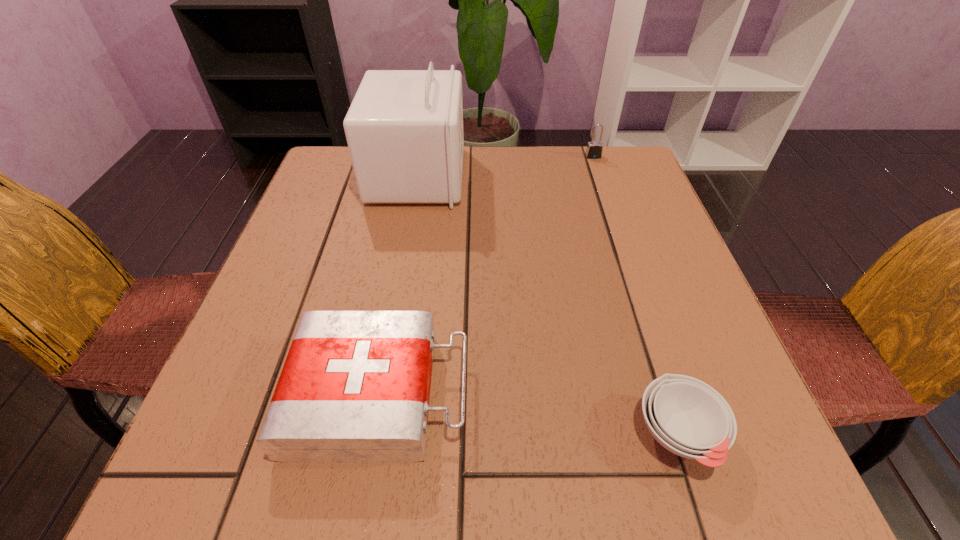
At what (x,y) coordinates should I click in order to perform the action: click on vacant space that satisfies the following two spatial constraints: 1. on the front side of the shorter first-aid kit; 2. on the left side of the soup bowl. Please return your answer as a coordinate pair (x, y). The height and width of the screenshot is (540, 960). Looking at the image, I should click on (372, 434).

You are a GUI agent. You are given a task and a screenshot of the screen. Output one action in this format:
    pyautogui.click(x=<x>, y=<y>)
    Task: Click on the blank space that satisfies the following two spatial constraints: 1. on the shackle of the padlock; 2. on the front-facing side of the tallest object
    
    Given the screenshot: What is the action you would take?
    pyautogui.click(x=599, y=176)

The height and width of the screenshot is (540, 960). I want to click on free location that satisfies the following two spatial constraints: 1. on the shackle of the padlock; 2. on the front-facing side of the farther first-aid kit, so click(x=599, y=176).

Locate an element on the screen. free space that satisfies the following two spatial constraints: 1. on the shackle of the second tallest object; 2. on the front-facing side of the farther first-aid kit is located at coordinates (599, 176).

The image size is (960, 540). Identify the location of vacant position in the image that satisfies the following two spatial constraints: 1. on the front-facing side of the taller first-aid kit; 2. on the right side of the shortest object. (372, 434).

Identify the location of blank space that satisfies the following two spatial constraints: 1. on the shackle of the padlock; 2. on the front side of the nearer first-aid kit. (673, 394).

Identify the location of free location that satisfies the following two spatial constraints: 1. on the front side of the shorter first-aid kit; 2. on the back side of the soup bowl. The width and height of the screenshot is (960, 540). (372, 434).